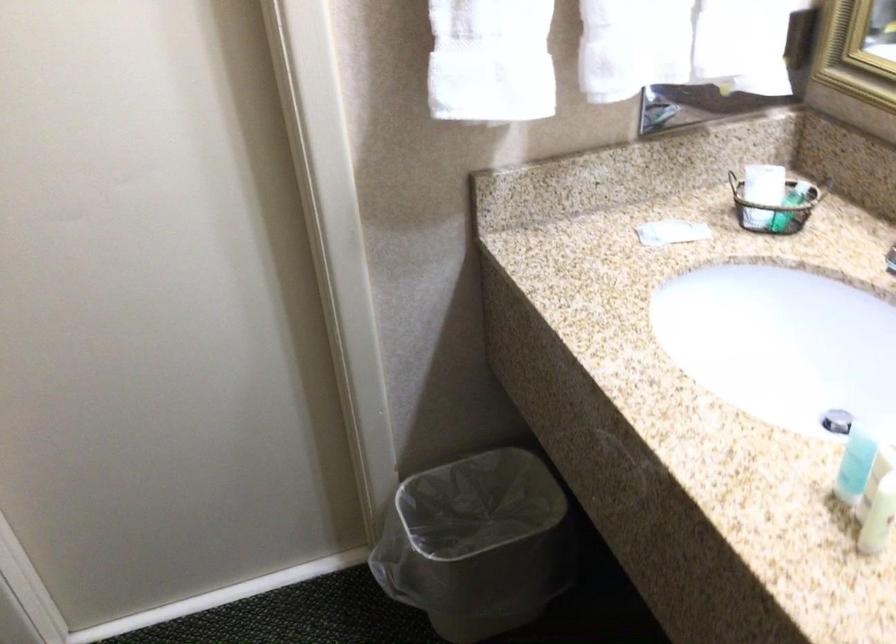
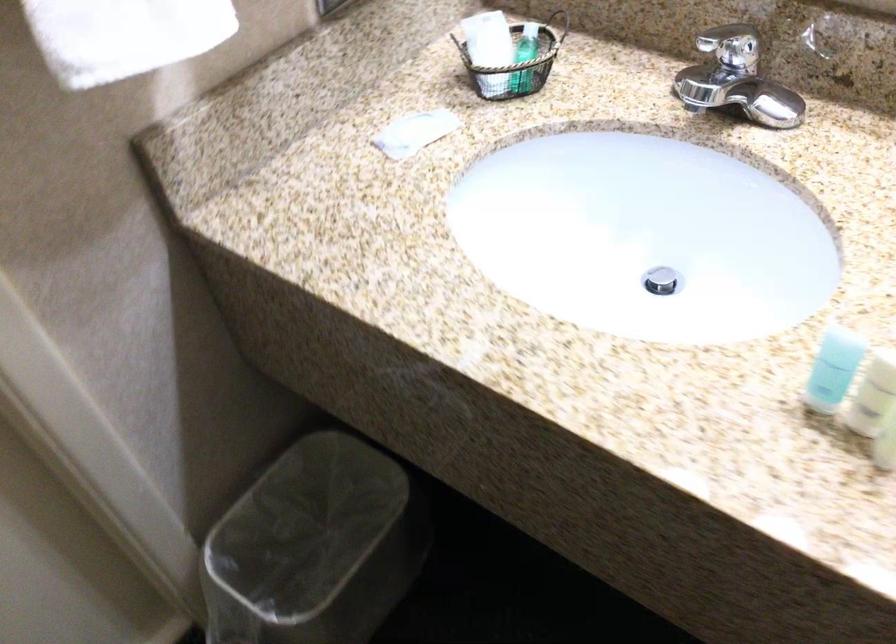
The point at (778, 202) is marked in the first image. Where is the corresponding point in the second image?

(524, 59)